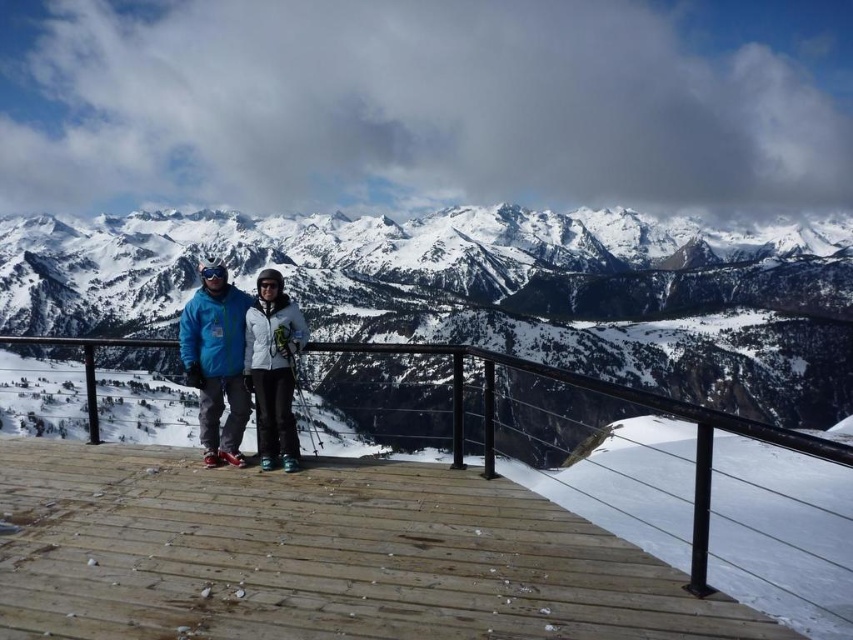
Image resolution: width=853 pixels, height=640 pixels. What do you see at coordinates (323, 556) in the screenshot? I see `black metal/rail at center` at bounding box center [323, 556].

Which is more to the right, black metal/rail at center or white matte jacket at center?

Positioned to the right is black metal/rail at center.

Describe the element at coordinates (323, 556) in the screenshot. I see `black metal/rail at center` at that location.

Where is `black metal/rail at center`? This screenshot has width=853, height=640. black metal/rail at center is located at coordinates (323, 556).

Does black metal/rail at center have a smaller size compared to snowy granite mountains at upper center?

Indeed, black metal/rail at center has a smaller size compared to snowy granite mountains at upper center.

Does black metal/rail at center come behind snowy granite mountains at upper center?

That is False.

Image resolution: width=853 pixels, height=640 pixels. In order to click on black metal/rail at center in this screenshot , I will do `click(323, 556)`.

Between point (202, 364) and point (265, 410), which one is positioned behind?

The point (202, 364) is behind.

Is point (212, 452) closer to viewer compared to point (248, 342)?

Yes.

This screenshot has width=853, height=640. What are the coordinates of `matte blue jacket at center` in the screenshot? It's located at (234, 358).